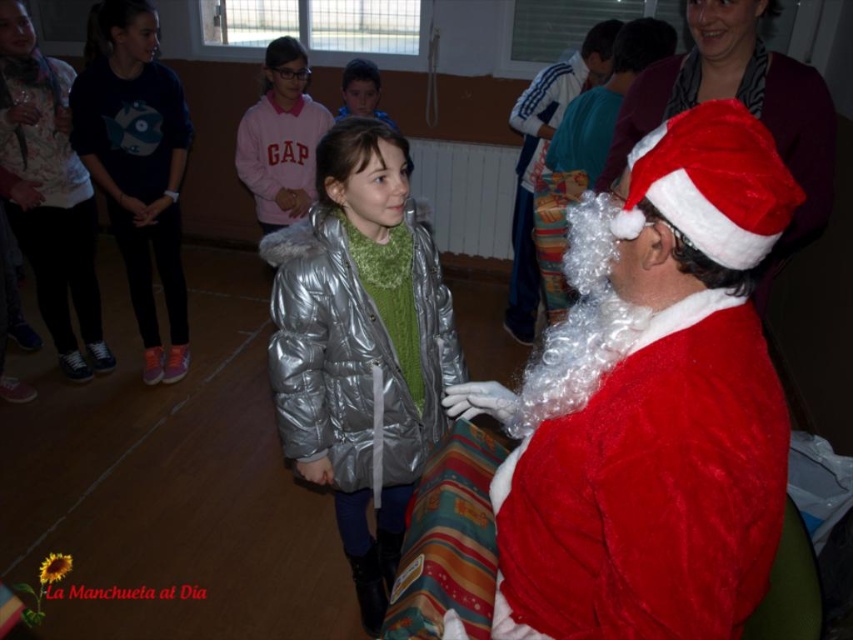
Is matte blue fish at left to the right of red fluffy santa hat at upper right from the viewer's perspective?

Incorrect, matte blue fish at left is not on the right side of red fluffy santa hat at upper right.

Is point (141, 180) positioned after point (532, 180)?

No, it is not.

Does point (155, 164) come in front of point (538, 124)?

That is True.

This screenshot has height=640, width=853. What are the coordinates of `matte blue fish at left` in the screenshot? It's located at (137, 164).

Looking at this image, between matte blue fish at left and pink fleece sweater at upper center, which one appears on the right side from the viewer's perspective?

pink fleece sweater at upper center is more to the right.

Which is in front, point (70, 92) or point (276, 129)?

Positioned in front is point (70, 92).

Between point (105, 33) and point (291, 170), which one is positioned behind?

Positioned behind is point (291, 170).

Find the location of `matte blue fish at left`. matte blue fish at left is located at coordinates (137, 164).

Consider the image. Who is higher up, shiny silver jacket at center or pink fleece sweater at upper center?

pink fleece sweater at upper center

This screenshot has height=640, width=853. What are the coordinates of `shiny silver jacket at center` in the screenshot? It's located at pos(361,346).